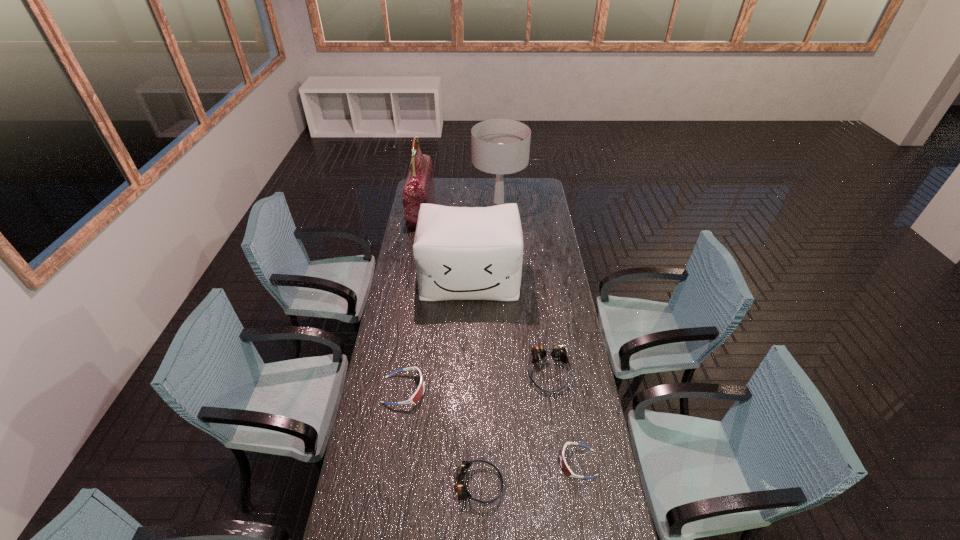
Locate an element on the screen. The height and width of the screenshot is (540, 960). lampshade is located at coordinates (499, 146).

Locate an element on the screen. The width and height of the screenshot is (960, 540). handbag is located at coordinates (419, 188).

Where is `cushion`? cushion is located at coordinates (461, 253).

This screenshot has width=960, height=540. I want to click on the fifth shortest object, so click(x=461, y=253).

Locate an element on the screen. the right bronze goggles is located at coordinates (558, 352).

What are the coordinates of `the farther bronze goggles` in the screenshot? It's located at (558, 352).

Where is `the farther red goggles`? the farther red goggles is located at coordinates (417, 395).

This screenshot has height=540, width=960. In order to click on the bigger red goggles in this screenshot , I will do `click(417, 395)`.

Image resolution: width=960 pixels, height=540 pixels. What are the coordinates of `the left bronze goggles` in the screenshot? It's located at (463, 466).

This screenshot has height=540, width=960. What are the coordinates of `the smaller bronze goggles` in the screenshot? It's located at (463, 466).